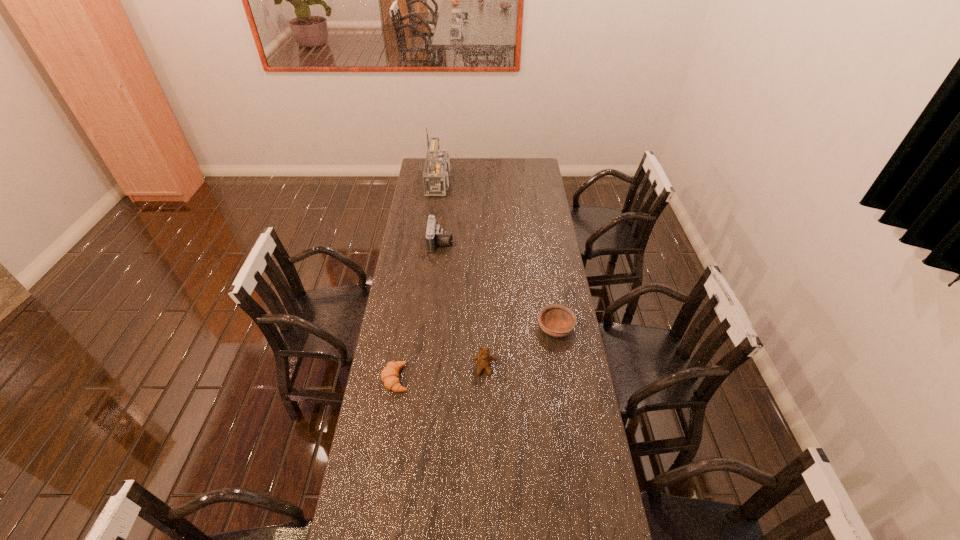
At what (x,y) coordinates should I click in order to perform the action: click on free space located on the back of the third farthest object. Please return your answer as a coordinate pair (x, y). The height and width of the screenshot is (540, 960). Looking at the image, I should click on (547, 271).

This screenshot has width=960, height=540. Identify the location of free location located 0.270m on the front of the crescent roll. (381, 472).

Identify the location of object that is at the far edge. (436, 172).

Find the location of a particular element. The image size is (960, 540). radio receiver present at the left edge is located at coordinates (436, 172).

This screenshot has height=540, width=960. What are the coordinates of `camera at the left edge` in the screenshot? It's located at (435, 236).

You are a GUI agent. You are given a task and a screenshot of the screen. Output one action in this format:
    pyautogui.click(x=<x>, y=<y>)
    Task: Click on the crescent roll that is at the left edge
    
    Given the screenshot: What is the action you would take?
    pyautogui.click(x=389, y=375)

Identify the location of object at the right edge. (556, 320).

Find the location of a particular element. object situated at the far left corner is located at coordinates (436, 172).

The width and height of the screenshot is (960, 540). I want to click on free space at the far edge of the desktop, so click(x=507, y=165).

The image size is (960, 540). I want to click on free location at the left edge of the desktop, so click(x=383, y=339).